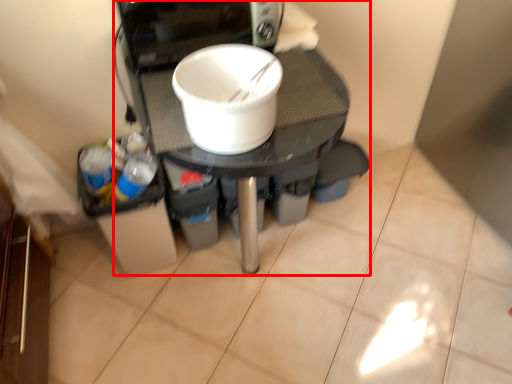
Question: From the image's perspective, what is the correct spatial relationship of appliance (annotated by the red box) in relation to tableware?

Choices:
 (A) above
 (B) below

Answer: (B)